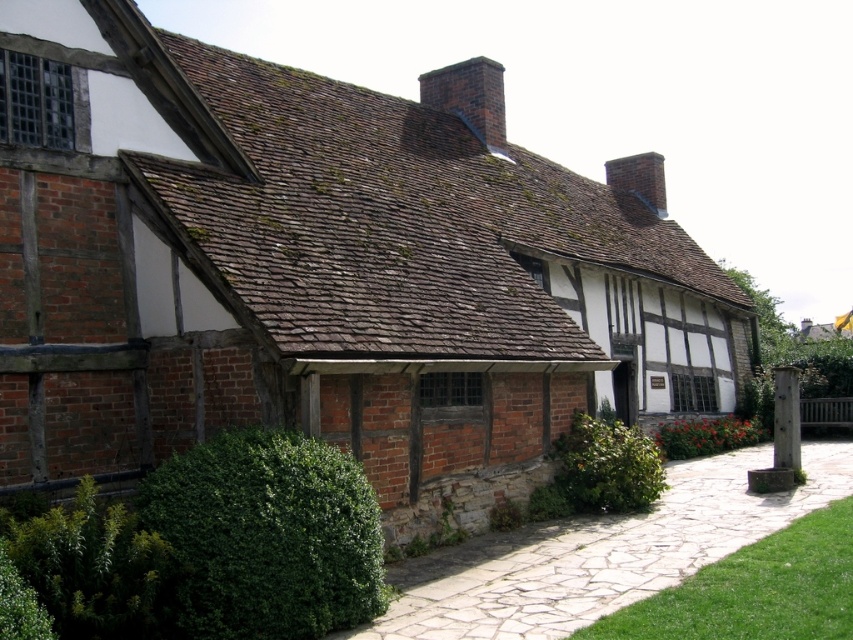
You are a gardener planning to trim the green leafy hedge at lower left and the brick chimney at upper center. Which object requires a ladder for safe maintenance?

The brick chimney at upper center requires a ladder for safe maintenance because it is taller than the green leafy hedge at lower left.

You are a gardener planning to trim the green leafy hedge at lower left and the brick chimney at upper center. Which object requires more horizontal space for trimming?

The brick chimney at upper center requires more horizontal space for trimming because its width is greater than the green leafy hedge at lower left.